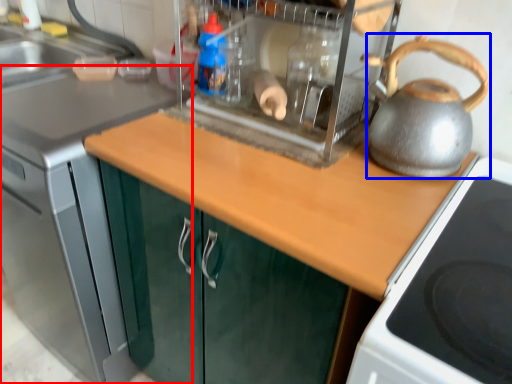
Question: Which object appears farthest to the camera in this image, countertop (highlighted by a red box) or kettle (highlighted by a blue box)?

Choices:
 (A) countertop
 (B) kettle

Answer: (A)